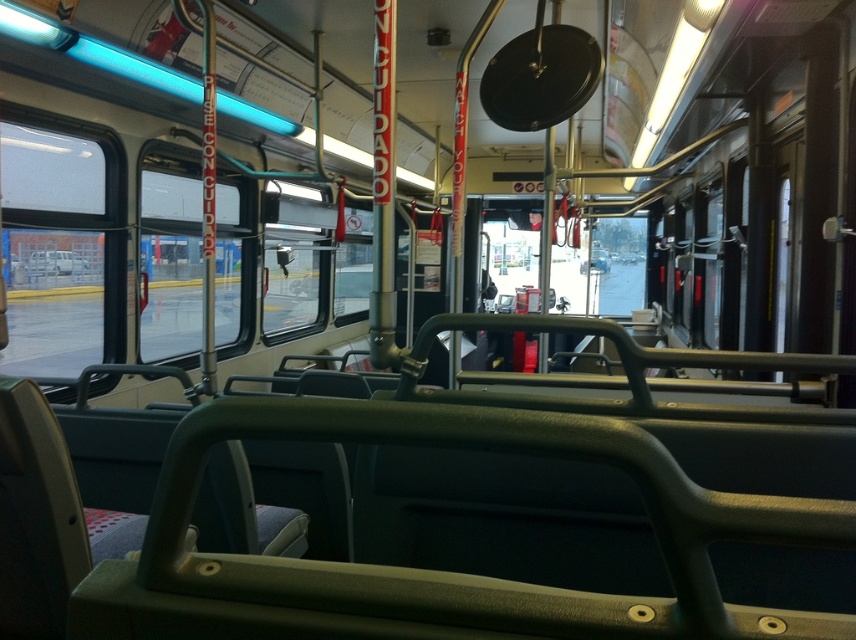
Which is more to the right, transparent glass window at left or transparent glass window at center?

Positioned to the right is transparent glass window at center.

Can you confirm if transparent glass window at left is positioned to the left of transparent glass window at center?

Indeed, transparent glass window at left is positioned on the left side of transparent glass window at center.

Describe the element at coordinates (60, 243) in the screenshot. The width and height of the screenshot is (856, 640). I see `transparent glass window at left` at that location.

The image size is (856, 640). I want to click on transparent glass window at left, so click(60, 243).